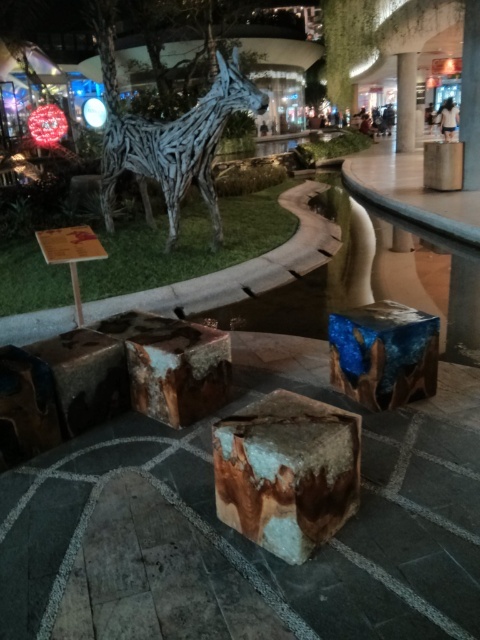
Who is positioned more to the left, wooden sculpture at center or brown wood stump at center?

Positioned to the left is wooden sculpture at center.

Who is taller, wooden sculpture at center or brown wood stump at center?

wooden sculpture at center is taller.

Find the location of `wooden sculpture at center`. wooden sculpture at center is located at coordinates (177, 145).

Can you confirm if blue resin cube at center is taller than brown wood stump at center?

In fact, blue resin cube at center may be shorter than brown wood stump at center.

Is point (344, 321) farther from viewer compared to point (201, 416)?

Yes, point (344, 321) is behind point (201, 416).

This screenshot has height=640, width=480. Find the location of `blue resin cube at center`. blue resin cube at center is located at coordinates (384, 353).

You are a GUI agent. You are given a task and a screenshot of the screen. Output one action in this format:
    pyautogui.click(x=<x>, y=<y>)
    Task: Click on the rustic wood stump at center
    This screenshot has width=480, height=640.
    Given the screenshot: What is the action you would take?
    pyautogui.click(x=287, y=472)

Measure the distance from rustic wood stump at center to smooth concrete pillar at upper right.

rustic wood stump at center is 52.80 feet away from smooth concrete pillar at upper right.

Is point (331, 452) positioned behind point (409, 129)?

No.

The width and height of the screenshot is (480, 640). I want to click on rustic wood stump at center, so (x=287, y=472).